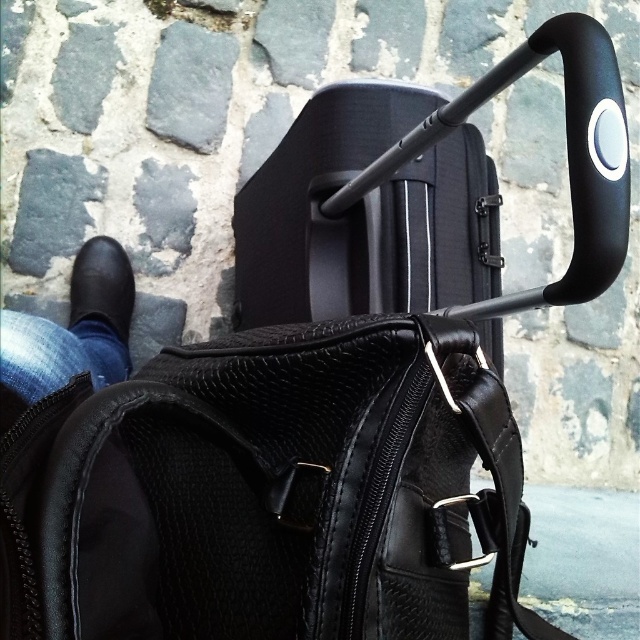
You are packing for a trip and need to place your black leather bag at center and matte black suitcase at upper center into the trunk of your car. Based on their positions in the image, which item should you load first to ensure easier access later?

The matte black suitcase at upper center should be loaded first because the black leather bag at center is positioned below it in the image, meaning the suitcase is closer to the trunk opening. Loading it first will allow you to reach it more easily later.

You are a delivery robot that needs to move the black leather bag at center to the black leather shoe at lower left. Given that your maximum reach is 32 inches, can you pick up the bag and place it directly next to the shoe without moving?

The black leather bag at center and black leather shoe at lower left are 33.91 inches apart, which exceeds your maximum reach of 32 inches. Therefore, you cannot pick up the bag and place it next to the shoe without moving.